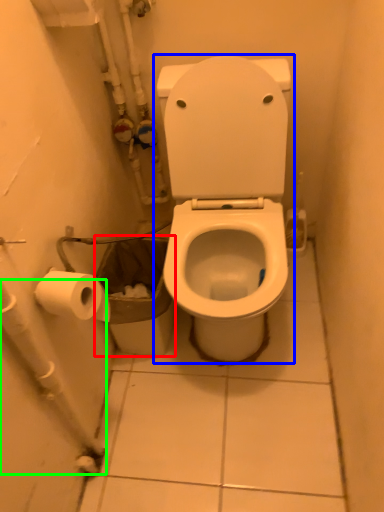
Question: Estimate the real-world distances between objects in this image. Which object is farther from garbage (highlighted by a red box), toilet (highlighted by a blue box) or water pipe (highlighted by a green box)?

Choices:
 (A) toilet
 (B) water pipe

Answer: (B)